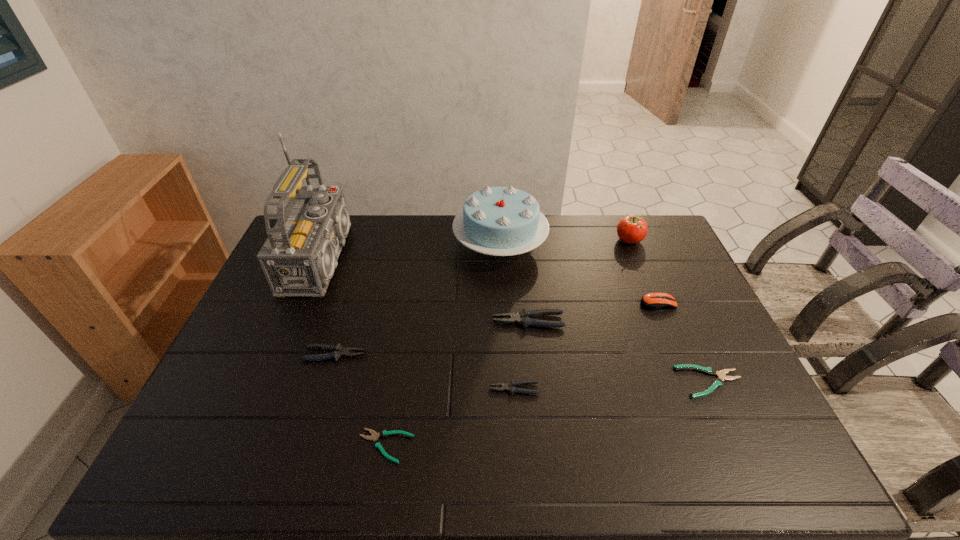
In order to click on the sixth farthest object in this screenshot , I will do `click(338, 351)`.

Where is `the second farthest pliers`? This screenshot has width=960, height=540. the second farthest pliers is located at coordinates (338, 351).

Identify the location of the nearest gray pliers. The image size is (960, 540). (510, 386).

Where is `the seventh tallest object`? the seventh tallest object is located at coordinates (510, 386).

Find the location of `the right teal pliers`. the right teal pliers is located at coordinates (718, 382).

In order to click on the farther teal pliers in this screenshot , I will do `click(718, 382)`.

Locate an element on the screen. Image resolution: width=960 pixels, height=540 pixels. the seventh object from right to left is located at coordinates pos(377,443).

Where is `the nearer teal pliers`? the nearer teal pliers is located at coordinates (377, 443).

The image size is (960, 540). What are the coordinates of `vacant region located 0.210m on the front-facing side of the tallest object` in the screenshot? It's located at (424, 259).

At what (x,y) coordinates should I click in order to perform the action: click on vacant region located on the left of the birthday cake. Please return your answer as a coordinate pair (x, y). The image size is (960, 540). Looking at the image, I should click on (431, 245).